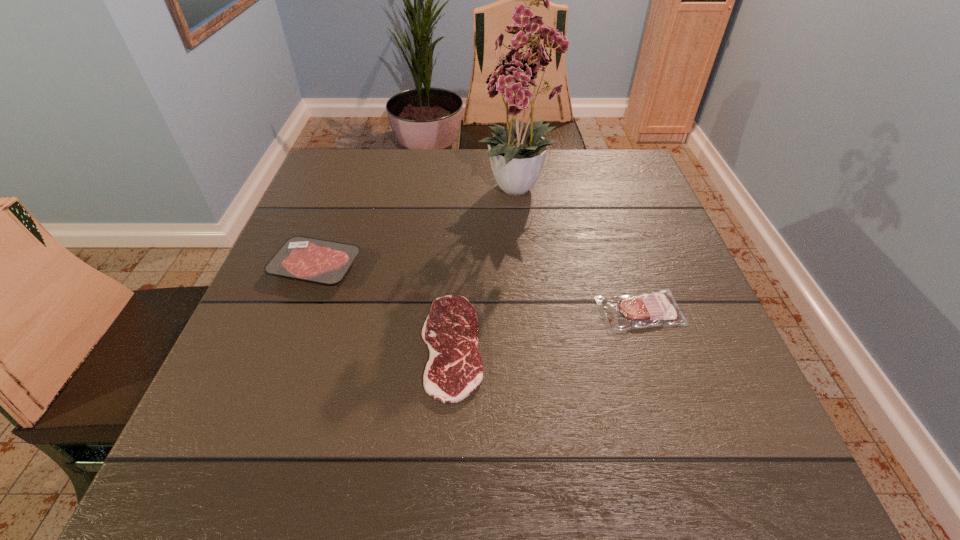
Image resolution: width=960 pixels, height=540 pixels. I want to click on the tallest object, so click(515, 155).

The height and width of the screenshot is (540, 960). I want to click on flower arrangement, so click(x=515, y=155).

Where is `the leftmost object`? The width and height of the screenshot is (960, 540). the leftmost object is located at coordinates (314, 260).

The width and height of the screenshot is (960, 540). Find the location of `the third shortest object`. the third shortest object is located at coordinates (314, 260).

At what (x,y) coordinates should I click in order to perform the action: click on the second shortest object. Please return your answer as a coordinate pair (x, y). Looking at the image, I should click on (657, 308).

Locate an element on the screen. Image resolution: width=960 pixels, height=540 pixels. the rightmost object is located at coordinates (657, 308).

Where is `the shortest object`? The height and width of the screenshot is (540, 960). the shortest object is located at coordinates (454, 370).

Identify the location of the second steak from left to right. The image size is (960, 540). tap(454, 370).

The width and height of the screenshot is (960, 540). What are the coordinates of `free space located 0.260m on the front-facing side of the tallest object` in the screenshot? It's located at (533, 316).

Identify the location of vacant region located on the right of the tallest steak. (499, 267).